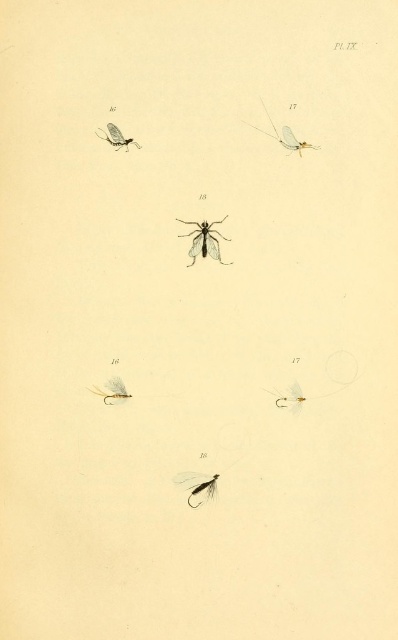
You are a researcher examining the page and need to locate the matte black fly at center and the translucent yellow fly at center. According to their positions, which fly is on the left side?

The translucent yellow fly at center is on the left side because the matte black fly at center is to the right of it.

You are an entomologist examining the page. You notice the matte black fly at center and the matte gold hook at lower right. Which of these two insects is bigger in the illustration?

The matte black fly at center is larger than the matte gold hook at lower right.